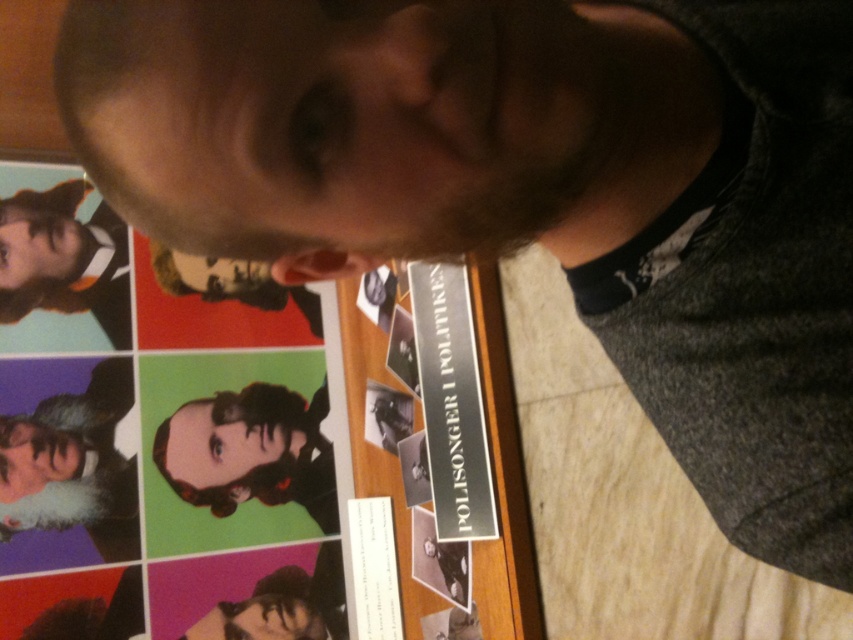
Is shiny black hair at center closer to camera compared to smooth black hair at lower center?

No, it is not.

Is shiny black hair at center further to camera compared to smooth black hair at lower center?

Yes, shiny black hair at center is further from the viewer.

Does point (200, 417) lie in front of point (219, 634)?

No.

Locate an element on the screen. shiny black hair at center is located at coordinates (250, 451).

Between matte black beard at upper left and smooth black hair at lower center, which one is positioned higher?

matte black beard at upper left is higher up.

Is the position of matte black beard at upper left less distant than that of smooth black hair at lower center?

No, matte black beard at upper left is behind smooth black hair at lower center.

Image resolution: width=853 pixels, height=640 pixels. Describe the element at coordinates (62, 259) in the screenshot. I see `matte black beard at upper left` at that location.

Locate an element on the screen. matte black beard at upper left is located at coordinates (62, 259).

Where is `white beard at lower left`? The width and height of the screenshot is (853, 640). white beard at lower left is located at coordinates (73, 465).